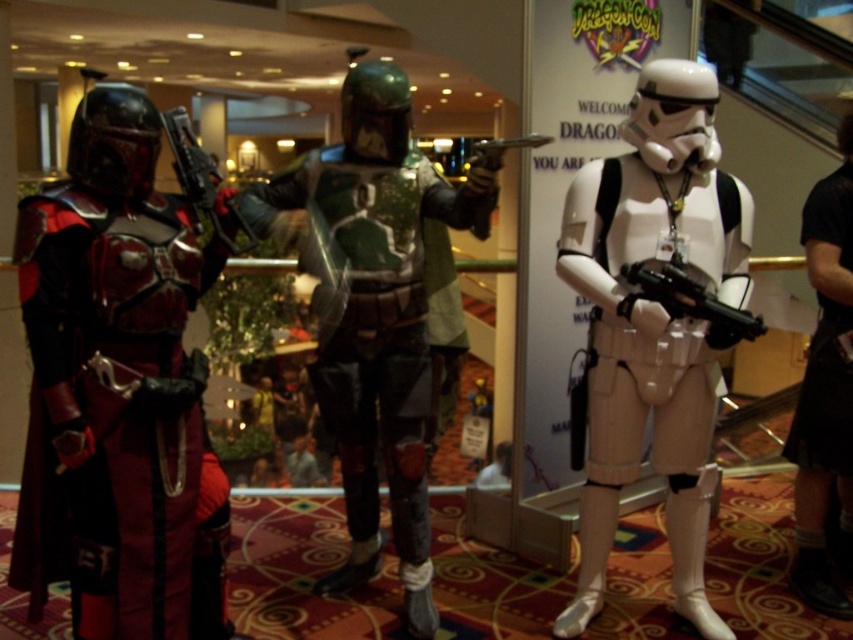
You are a photographer at DragonCon trying to capture a detailed shot of both the green camouflage armor at center and the metallic silver gun at center. Since you want to ensure both are clearly visible, which object should you focus on first considering their sizes?

The green camouflage armor at center is larger than the metallic silver gun at center, so focusing on the larger object first would ensure proper focus and visibility for both.